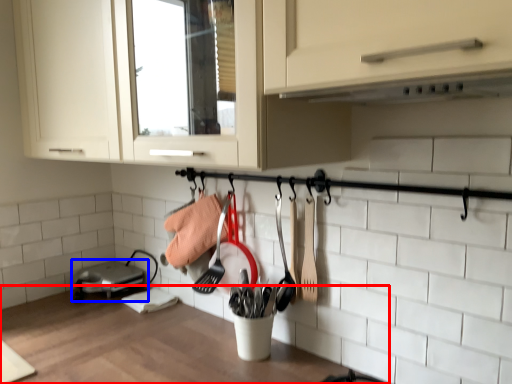
Question: Which object appears farthest to the camera in this image, countertop (highlighted by a red box) or home appliance (highlighted by a blue box)?

Choices:
 (A) countertop
 (B) home appliance

Answer: (B)